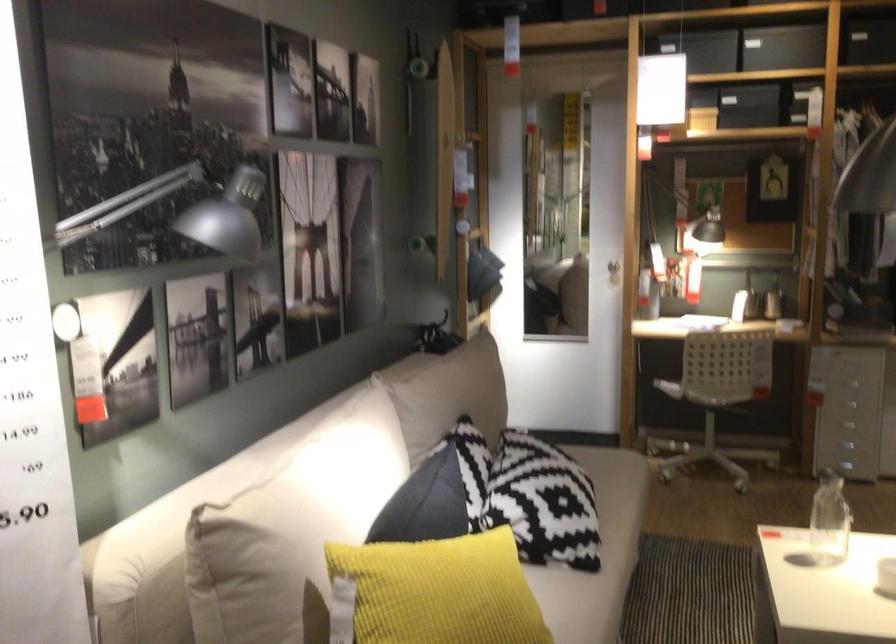
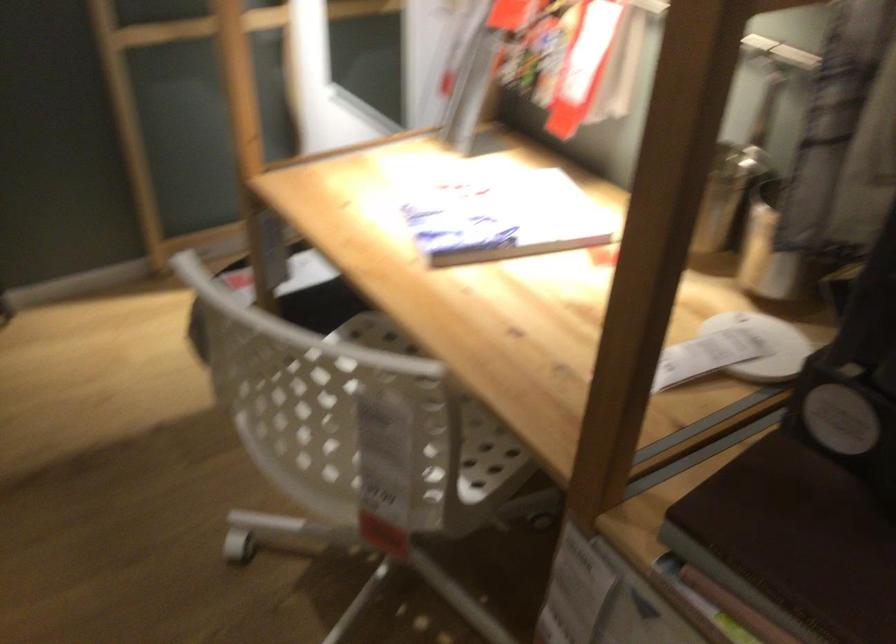
In the second image, find the point that corresponds to the point at 774,330 in the first image.

(371, 418)